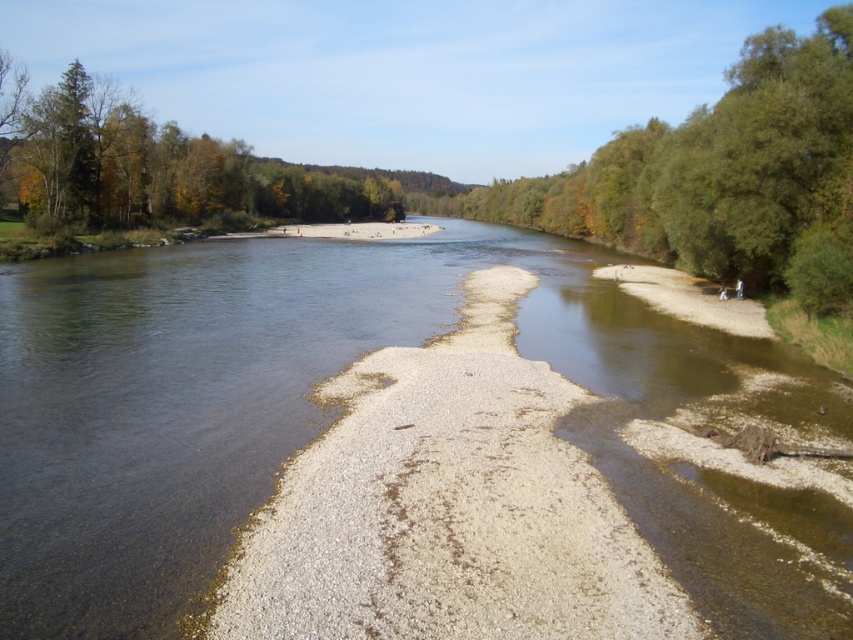
You are standing on the riverbank and want to cross to the other side. You see the clear water at center and the green leafy tree at right. Which object is closer to the ground?

The clear water at center is shorter than the green leafy tree at right, so the clear water at center is closer to the ground.

You are standing at the center of the river and want to walk to the nearest tree. Which tree should you head towards, the green leafy tree at right or the green leafy tree at upper left?

The green leafy tree at upper left is closer to the center of the river than the green leafy tree at right, so you should head towards the green leafy tree at upper left.

You are standing at the center of the river and looking towards the green leafy tree at right and the green leafy tree at upper left. Which tree would appear narrower from your current position?

The green leafy tree at right is thinner than the green leafy tree at upper left, so it would appear narrower from your current position at the center of the river.